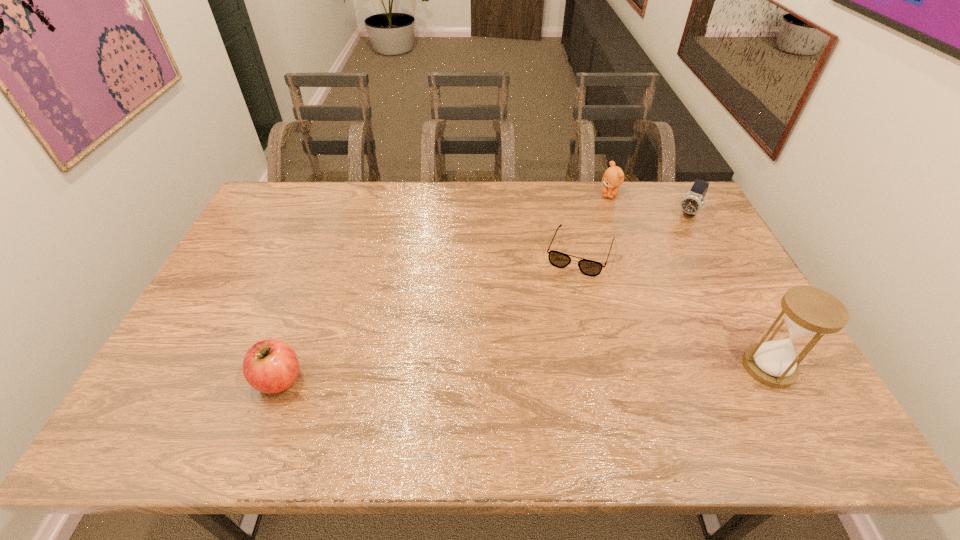
You are a GUI agent. You are given a task and a screenshot of the screen. Output one action in this format:
    pyautogui.click(x=<x>, y=<y>)
    Task: Click on the leftmost object
    The height and width of the screenshot is (540, 960).
    Given the screenshot: What is the action you would take?
    pyautogui.click(x=270, y=366)

At what (x,y) coordinates should I click in order to perform the action: click on hourglass. Please return your answer as a coordinate pair (x, y). Looking at the image, I should click on [808, 312].

Find the location of a particular element. the second farthest object is located at coordinates tap(691, 203).

Find the location of a particular element. The height and width of the screenshot is (540, 960). the third farthest object is located at coordinates (558, 259).

Locate an element on the screen. The width and height of the screenshot is (960, 540). the fourth object from right to left is located at coordinates (558, 259).

You are a GUI agent. You are given a task and a screenshot of the screen. Output one action in this format:
    pyautogui.click(x=<x>, y=<y>)
    Task: Click on the third object from left to right
    The height and width of the screenshot is (540, 960).
    Given the screenshot: What is the action you would take?
    pyautogui.click(x=613, y=177)

You are a GUI agent. You are given a task and a screenshot of the screen. Output one action in this format:
    pyautogui.click(x=<x>, y=<y>)
    Task: Click on the teddy bear
    
    Given the screenshot: What is the action you would take?
    pyautogui.click(x=613, y=177)

In order to click on vacant area located on the back of the apple in this screenshot , I will do `click(305, 309)`.

Locate an element on the screen. The height and width of the screenshot is (540, 960). free region located on the back of the hourglass is located at coordinates click(x=718, y=274).

This screenshot has width=960, height=540. Identify the location of blank space located on the face of the watch. (670, 242).